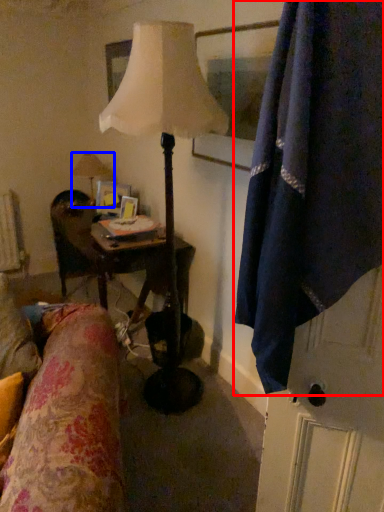
Question: Among these objects, which one is nearest to the camera, curtain (highlighted by a red box) or lamp (highlighted by a blue box)?

Choices:
 (A) curtain
 (B) lamp

Answer: (A)